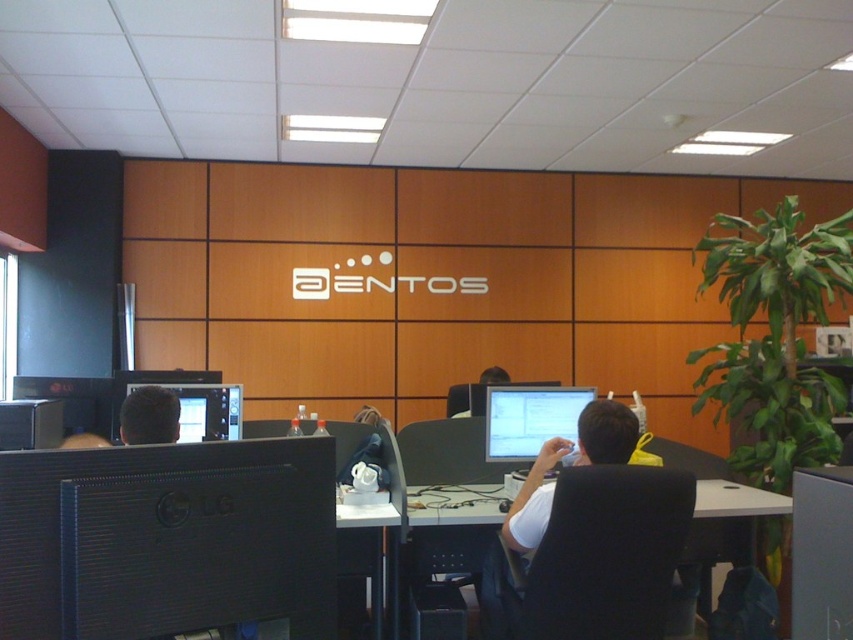
You are setting up a new monitor in the office. The matte black monitor at center is currently placed on the white plastic table at center. Since the monitor is taller than the table, will it block the view of the ENTOS logo on the wall panel behind it?

The matte black monitor at center is taller than the white plastic table at center, so it will block the view of the ENTOS logo on the wall panel behind it because the monitor extends above the table.

In the office scene described, there is a matte black monitor at center and a white plastic table at center. From the perspective of someone facing the wall with the ENTOS logo, which object is positioned to the right?

The matte black monitor at center is positioned to the right of the white plastic table at center.

From the picture: In the office scene described, there is a black glossy monitor at lower left. If you were standing at the point marked by coordinates point (166, 538), would you be directly in front of the monitor?

Yes, the point (166, 538) marks the black glossy monitor at lower left, so standing there places you directly in front of it.